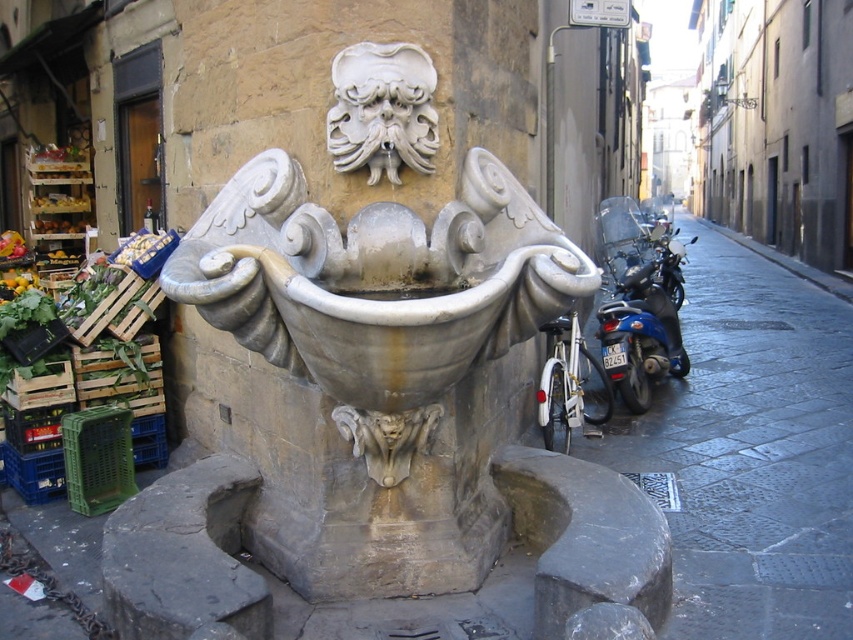
You are an artist planning to sketch the stone fountain at center and the white stone mask at center in the urban scene. Which object should you draw first if you want to start with the larger one?

The stone fountain at center is bigger than the white stone mask at center, so you should draw the stone fountain at center first.

You are an architect designing a new public square and want to place a statue that is shorter than the existing stone fountain at center. You have a white stone mask at center available. Will this statue fit the requirement?

The stone fountain at center is taller than the white stone mask at center, so the white stone mask at center is shorter and will fit the requirement.

You are a delivery person who needs to park your white matte motorbike at right near the stone fountain at center without blocking the sidewalk. Considering the height difference between them, which object should you position closer to the sidewalk to ensure enough clearance for pedestrians?

The white matte motorbike at right should be positioned closer to the sidewalk since the stone fountain at center is much taller and would require more space away from the path to ensure pedestrians have enough clearance.